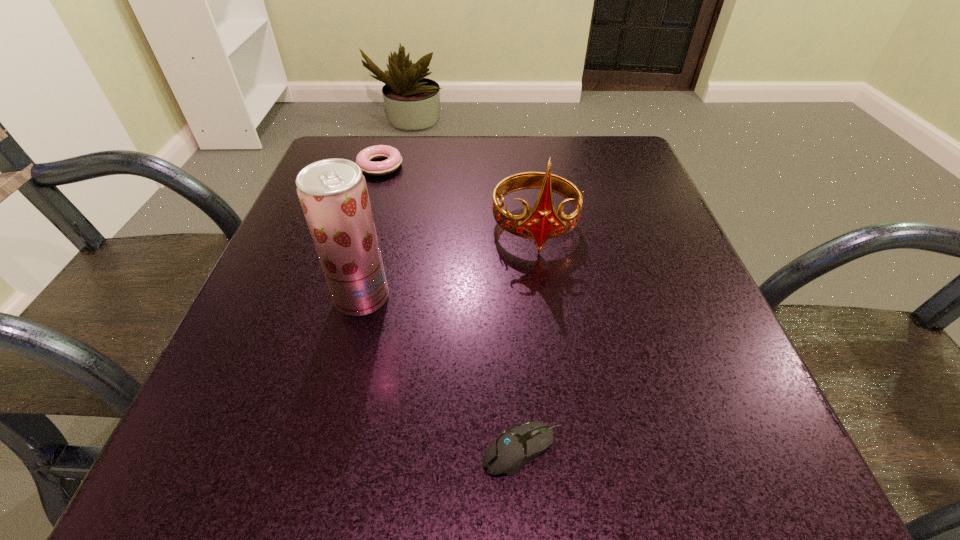
Find the location of a particular element. Image resolution: width=960 pixels, height=540 pixels. free space between the farthest object and the nearest object is located at coordinates pos(452,308).

Locate an element on the screen. The height and width of the screenshot is (540, 960). vacant space in between the third farthest object and the computer mouse is located at coordinates (443, 374).

The width and height of the screenshot is (960, 540). I want to click on free space between the second farthest object and the farthest object, so click(458, 197).

At what (x,y) coordinates should I click in order to perform the action: click on vacant space that is in between the farthest object and the tiara. Please return your answer as a coordinate pair (x, y). The image size is (960, 540). Looking at the image, I should click on (458, 197).

At what (x,y) coordinates should I click in order to perform the action: click on vacant space that is in between the tiara and the farthest object. Please return your answer as a coordinate pair (x, y). Looking at the image, I should click on (458, 197).

This screenshot has width=960, height=540. I want to click on free area in between the tiara and the doughnut, so click(458, 197).

Locate an element on the screen. This screenshot has width=960, height=540. vacant space that is in between the second farthest object and the fruit juice is located at coordinates (448, 263).

What are the coordinates of `vacant region between the second farthest object and the computer mouse` in the screenshot? It's located at (529, 339).

This screenshot has height=540, width=960. In order to click on free space between the tiara and the doughnut in this screenshot , I will do `click(458, 197)`.

Identify which object is located as the second nearest to the third shortest object. Please provide its 2D coordinates. Your answer should be formatted as a tuple, i.e. [(x, y)], where the tuple contains the x and y coordinates of a point satisfying the conditions above.

[(364, 159)]